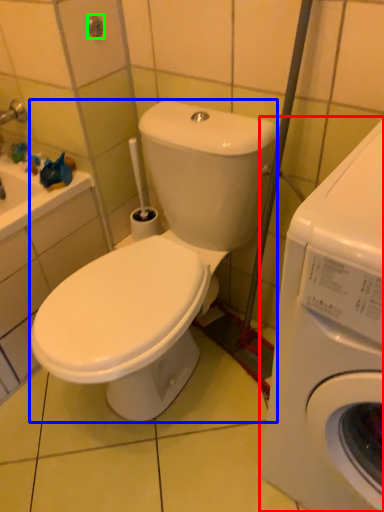
Question: Which is farther away from washing machine (highlighted by a red box)? washing machine (highlighted by a blue box) or shower (highlighted by a green box)?

Choices:
 (A) washing machine
 (B) shower

Answer: (B)